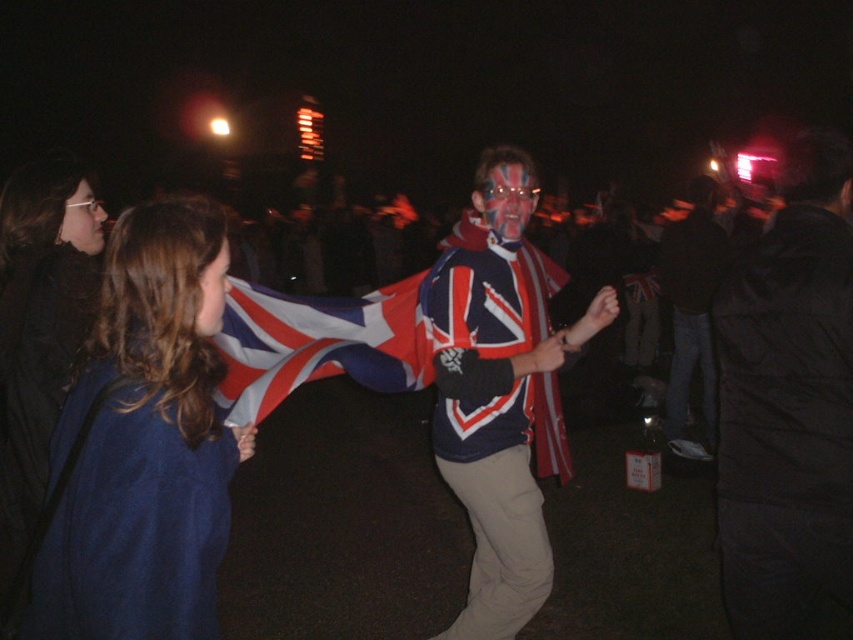
You are at a nighttime event and see the matte black glasses at upper left and the matte red flag at center. Which object is positioned higher in the scene?

The matte black glasses at upper left is located above the matte red flag at center, so it is positioned higher.

In the nighttime scene with two people, where one has a Union Jack scarf and face paint, can you determine the spatial relationship between the matte black glasses at upper left and the matte red flag at center?

The matte black glasses at upper left are positioned to the left of the matte red flag at center.

You are a photographer trying to capture a clear shot of both the dark blue jacket at center and the matte black glasses at upper left. Since you can only focus on one object at a time, which one should you choose to ensure it appears sharp in the photo?

You should focus on the dark blue jacket at center because it is closer to you than the matte black glasses at upper left, making it easier to capture sharply while the background object may appear slightly blurry.